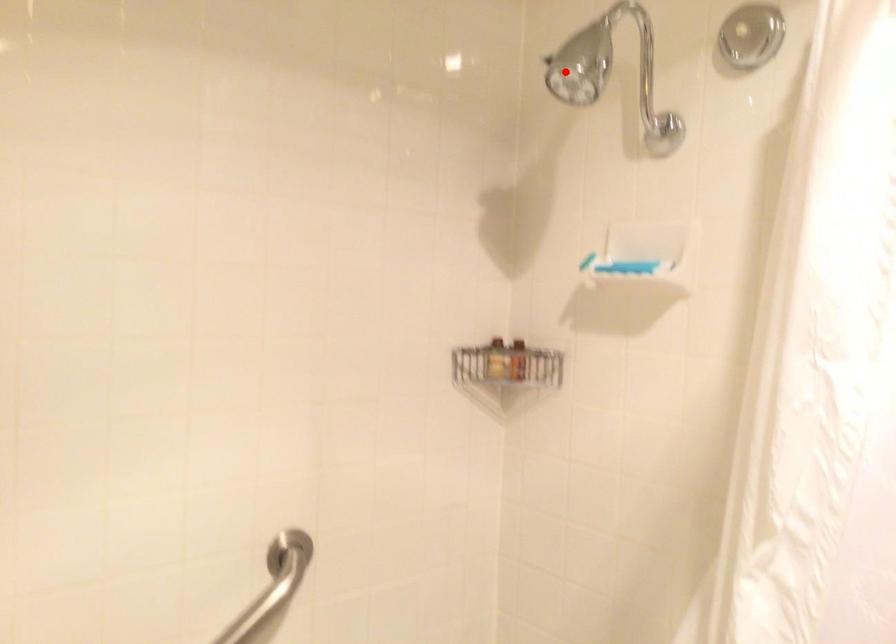
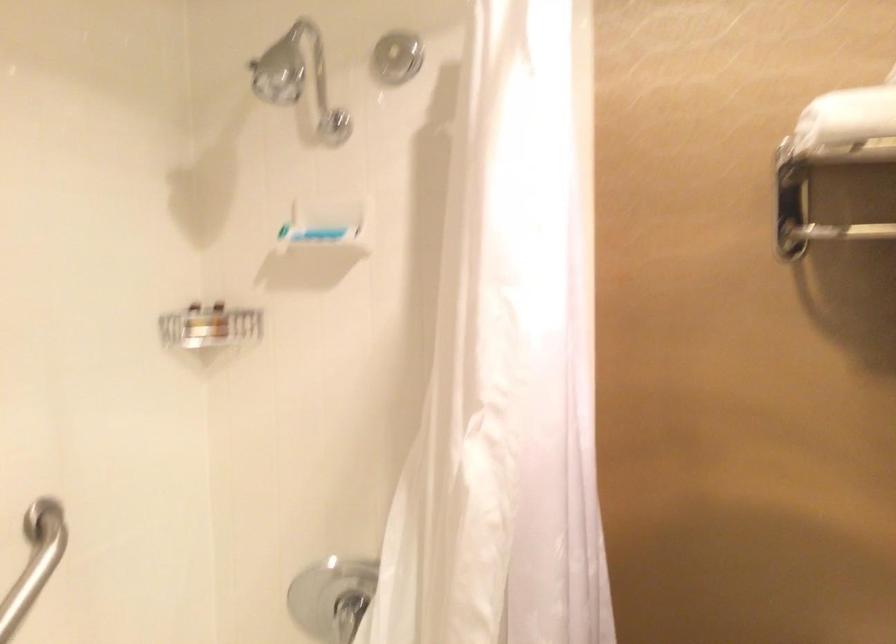
Question: I am providing you with two images of the same scene from different viewpoints. Given a red point in image1, look at the same physical point in image2. Is it:

Choices:
 (A) Closer to the viewpoint
 (B) Farther from the viewpoint

Answer: (B)